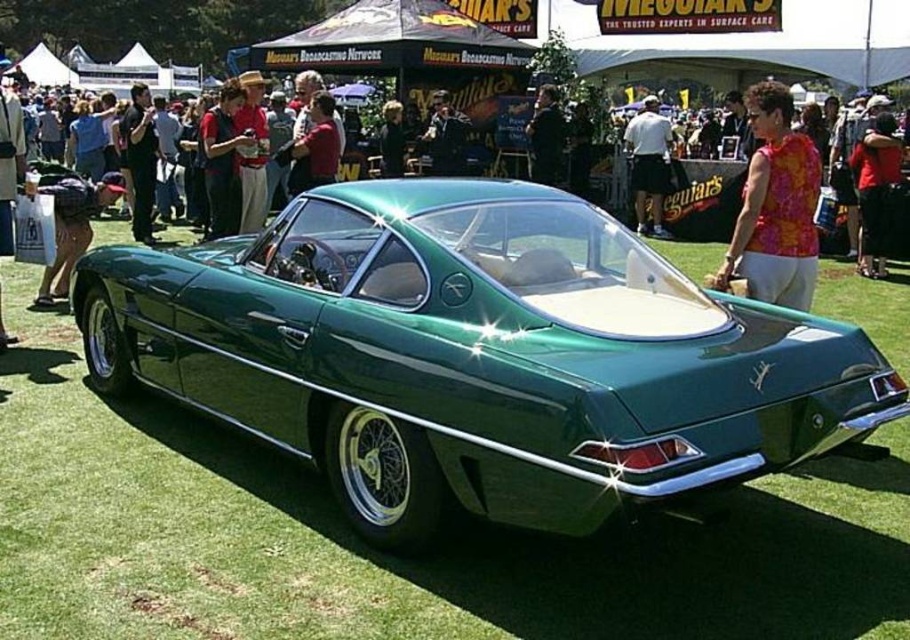
You are a photographer at the car show and want to capture both the green glossy car at center and the white cotton shirt at center in a single frame. Since the camera has a fixed focus, which object should you focus on to ensure the larger one is sharp?

The green glossy car at center is larger than the white cotton shirt at center, so you should focus on the green glossy car at center to ensure it appears sharp in the photo.